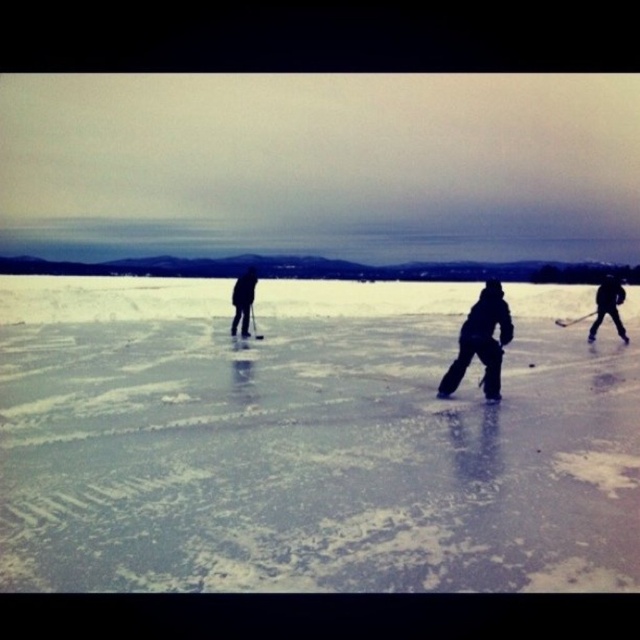
Question: Does dark gray ice skates at center have a greater width compared to black matte skates at right?

Choices:
 (A) yes
 (B) no

Answer: (A)

Question: Which of the following is the closest to the observer?

Choices:
 (A) dark gray fabric jacket at center
 (B) black matte hockey at center
 (C) dark gray ice skates at center

Answer: (C)

Question: Which of the following is the closest to the observer?

Choices:
 (A) dark gray fabric jacket at center
 (B) dark gray fabric pants at center

Answer: (B)

Question: Estimate the real-world distances between objects in this image. Which object is farther from the dark gray fabric pants at center?

Choices:
 (A) dark gray fabric jacket at center
 (B) black matte hockey stick at right
 (C) black matte hockey at center

Answer: (B)

Question: Is dark gray ice skates at center positioned in front of dark gray fabric jacket at center?

Choices:
 (A) no
 (B) yes

Answer: (B)

Question: Does dark gray fabric jacket at center appear on the right side of black matte hockey at center?

Choices:
 (A) no
 (B) yes

Answer: (A)